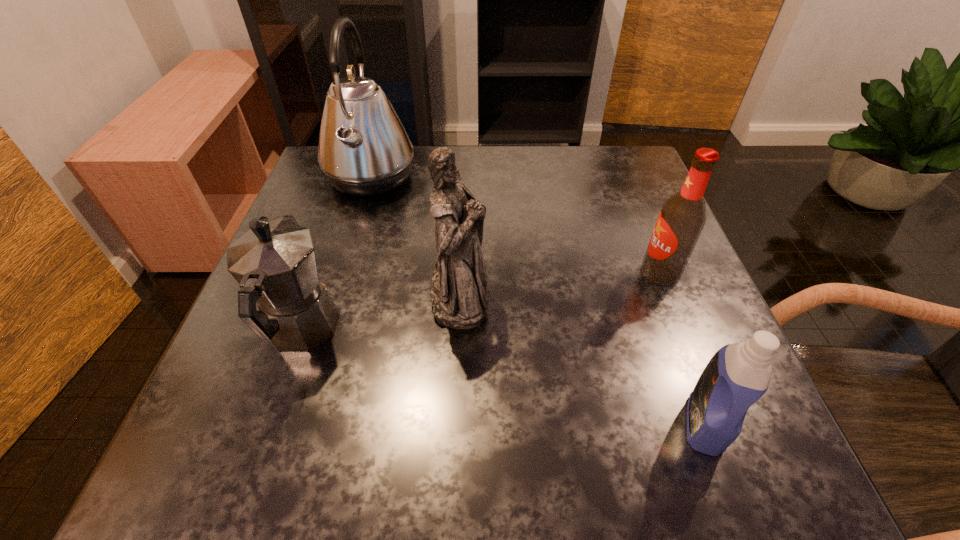
This screenshot has width=960, height=540. Find the location of `object that is at the near right corner`. object that is at the near right corner is located at coordinates (738, 374).

This screenshot has width=960, height=540. I want to click on free region at the far edge of the desktop, so click(552, 164).

In the image, there is a desktop. Where is `vacant space at the near edge`? vacant space at the near edge is located at coordinates (412, 438).

Find the location of a particular element. vacant region at the left edge of the desktop is located at coordinates (331, 249).

Identify the location of free space at the right edge. (606, 253).

The width and height of the screenshot is (960, 540). What are the coordinates of `vacant region at the far left corner of the desktop` in the screenshot? It's located at (325, 188).

This screenshot has width=960, height=540. Identify the location of blank area at the far right corner. (643, 166).

This screenshot has height=540, width=960. Identify the location of free space between the beer bottle and the third object from right to left. coord(560,284).

Locate an element on the screen. blank region between the detergent and the coffeepot is located at coordinates (503, 377).

Where is `unoccupied area between the detergent and the coffeepot`? unoccupied area between the detergent and the coffeepot is located at coordinates (503, 377).